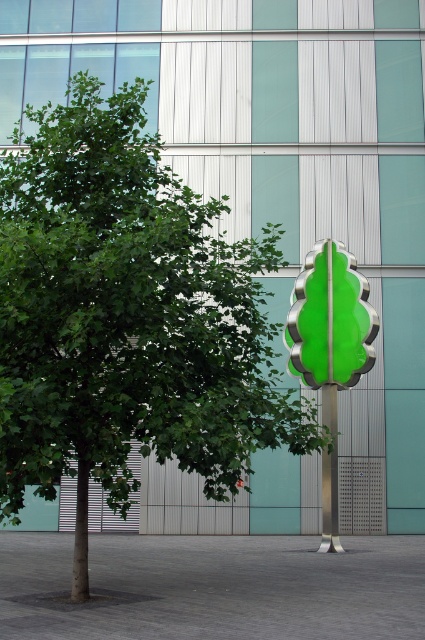
Is green leafy tree at center bigger than green glass traffic light at center?

Incorrect, green leafy tree at center is not larger than green glass traffic light at center.

Who is more forward, (x=237, y=323) or (x=339, y=296)?

Point (x=237, y=323) is more forward.

Where is `green leafy tree at center`? green leafy tree at center is located at coordinates (127, 317).

Between green leafy tree at center and metallic pole at center, which one is positioned higher?

green leafy tree at center

Which is more to the right, green leafy tree at center or metallic pole at center?

Positioned to the right is metallic pole at center.

Who is more forward, (306, 444) or (323, 504)?

Positioned in front is point (306, 444).

At what (x,y) coordinates should I click in order to perform the action: click on green leafy tree at center. Please return your answer as a coordinate pair (x, y). This screenshot has width=425, height=640. Looking at the image, I should click on (127, 317).

Based on the photo, between green glass traffic light at center and metallic pole at center, which one appears on the left side from the viewer's perspective?

From the viewer's perspective, metallic pole at center appears more on the left side.

Which is behind, point (322, 342) or point (334, 387)?

The point (334, 387) is behind.

At what (x,y) coordinates should I click in order to perform the action: click on green glass traffic light at center. Please return your answer as a coordinate pair (x, y). Looking at the image, I should click on (329, 320).